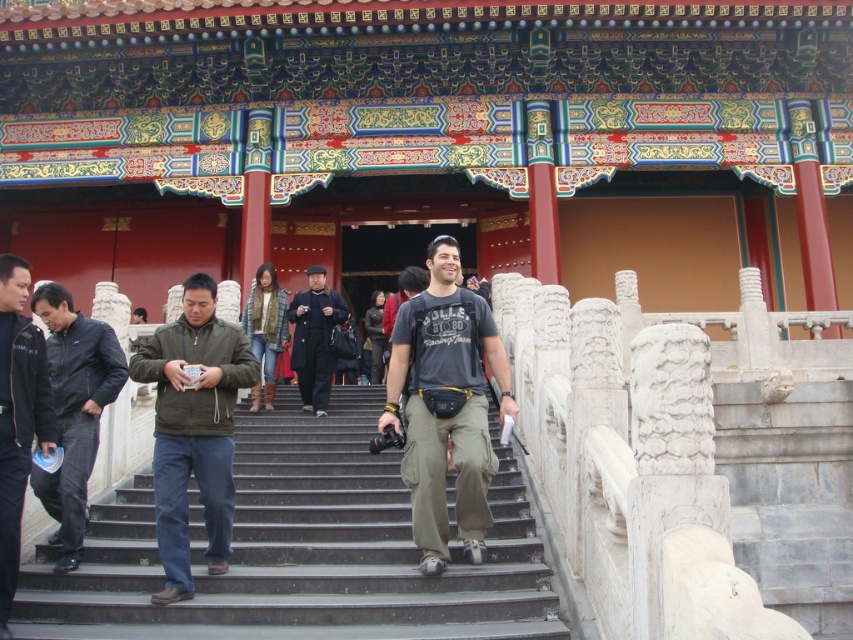
Does dark gray cotton t-shirt at center have a larger size compared to dark blue jeans at left?

No.

Is point (463, 346) positioned behind point (49, 484)?

Yes, it is.

Where is `dark gray cotton t-shirt at center`? Image resolution: width=853 pixels, height=640 pixels. dark gray cotton t-shirt at center is located at coordinates (445, 404).

Can you confirm if dark green jacket at center is bigger than black leather jacket at lower left?

Indeed, dark green jacket at center has a larger size compared to black leather jacket at lower left.

Between point (251, 385) and point (9, 426), which one is positioned behind?

The point (251, 385) is behind.

Who is more distant from viewer, (202, 429) or (38, 396)?

Positioned behind is point (202, 429).

Find the location of a particular element. Image resolution: width=853 pixels, height=640 pixels. dark green jacket at center is located at coordinates (193, 429).

Can you confirm if smooth concrete stairs at center is positioned to the left of dark brown leather jacket at center?

In fact, smooth concrete stairs at center is to the right of dark brown leather jacket at center.

How distant is smooth concrete stairs at center from dark brown leather jacket at center?

smooth concrete stairs at center and dark brown leather jacket at center are 22.03 meters apart from each other.

Which is behind, point (28, 576) or point (367, 333)?

Positioned behind is point (367, 333).

I want to click on smooth concrete stairs at center, so click(x=300, y=548).